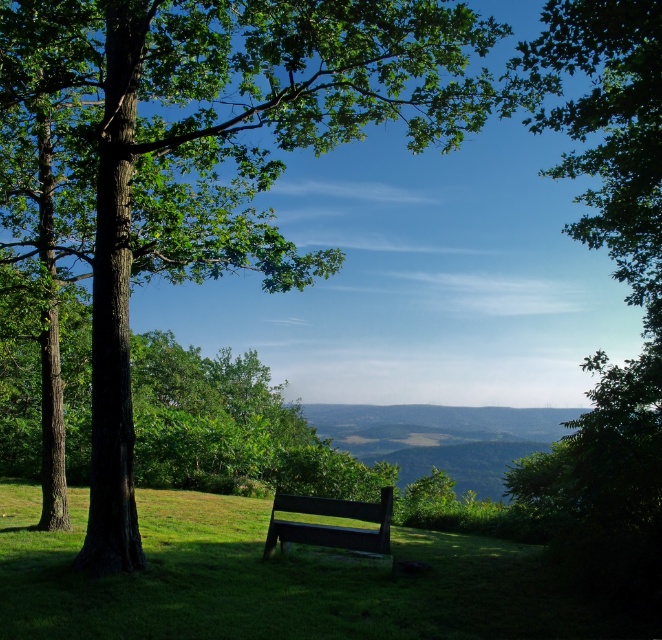
Does green rough bark tree at center have a larger size compared to green matte bench at center?

Indeed, green rough bark tree at center has a larger size compared to green matte bench at center.

Is point (130, 560) positioned after point (318, 540)?

No.

The width and height of the screenshot is (662, 640). I want to click on green rough bark tree at center, so click(207, 150).